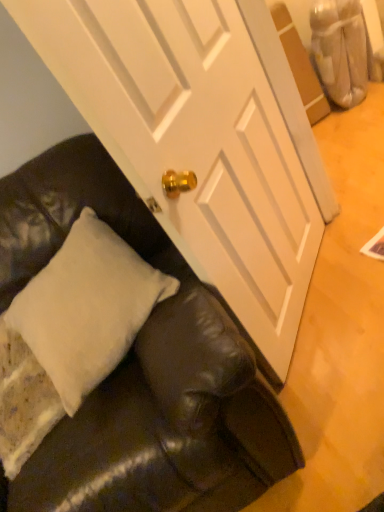
Question: Visually, is black leather couch at lower left positioned to the left or to the right of white soft pillow at lower left?

Choices:
 (A) right
 (B) left

Answer: (A)

Question: From a real-world perspective, is black leather couch at lower left positioned above or below white soft pillow at lower left?

Choices:
 (A) below
 (B) above

Answer: (A)

Question: Considering the positions of black leather couch at lower left and white soft pillow at lower left in the image, is black leather couch at lower left taller or shorter than white soft pillow at lower left?

Choices:
 (A) tall
 (B) short

Answer: (A)

Question: Would you say white soft pillow at lower left is inside or outside black leather couch at lower left?

Choices:
 (A) inside
 (B) outside

Answer: (A)

Question: Considering the relative positions of white soft pillow at lower left and black leather couch at lower left in the image provided, is white soft pillow at lower left to the left or to the right of black leather couch at lower left?

Choices:
 (A) right
 (B) left

Answer: (B)

Question: Is point (62, 365) closer or farther from the camera than point (94, 394)?

Choices:
 (A) farther
 (B) closer

Answer: (B)

Question: From the image's perspective, is white soft pillow at lower left located above or below black leather couch at lower left?

Choices:
 (A) above
 (B) below

Answer: (A)